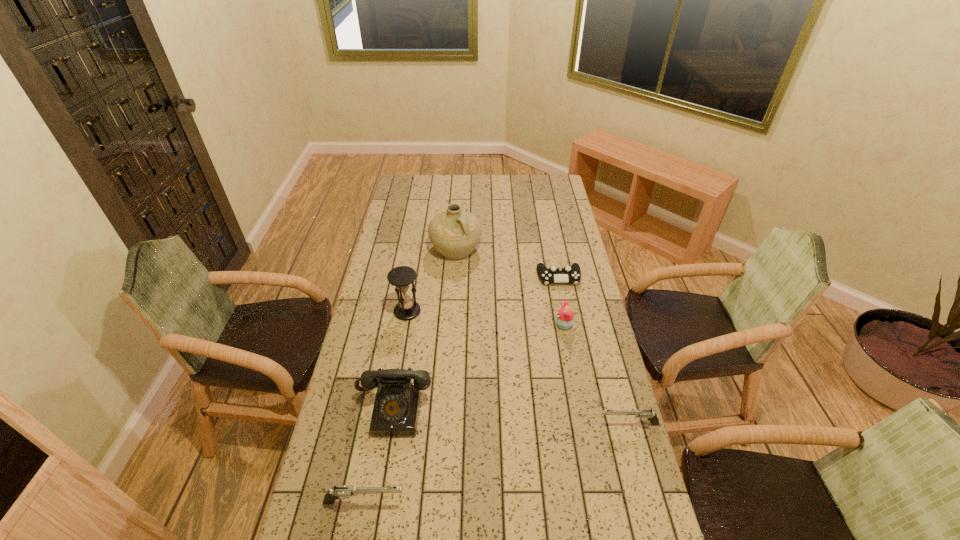
You are a GUI agent. You are given a task and a screenshot of the screen. Output one action in this format:
    pyautogui.click(x=<x>, y=<y>)
    Task: Click on the vacant space that's between the cupcake and the control
    
    Given the screenshot: What is the action you would take?
    pyautogui.click(x=562, y=301)

I want to click on free point between the cupcake and the left pistol, so click(x=464, y=414).

Locate an element on the screen. The width and height of the screenshot is (960, 540). the second closest object to the farther pistol is located at coordinates (396, 408).

The width and height of the screenshot is (960, 540). Find the location of `the second closest object relative to the sixth nearest object`. the second closest object relative to the sixth nearest object is located at coordinates (455, 233).

At what (x,y) coordinates should I click in order to perform the action: click on free space that satisfies the following two spatial constraints: 1. on the surface of the second farthest object; 2. on the face of the cupcake. Please return your answer as a coordinate pair (x, y). This screenshot has height=540, width=960. Looking at the image, I should click on (568, 325).

Locate an element on the screen. The height and width of the screenshot is (540, 960). free location that satisfies the following two spatial constraints: 1. on the surface of the second farthest object; 2. on the face of the cupcake is located at coordinates (568, 325).

The image size is (960, 540). Find the location of `blank space that satisfies the following two spatial constraints: 1. on the surface of the control; 2. on the front-facing side of the left pistol`. blank space that satisfies the following two spatial constraints: 1. on the surface of the control; 2. on the front-facing side of the left pistol is located at coordinates (603, 502).

Locate an element on the screen. free space that satisfies the following two spatial constraints: 1. on the dial of the third tallest object; 2. on the front-facing side of the nearest object is located at coordinates (x=378, y=502).

At what (x,y) coordinates should I click in order to perform the action: click on vacant position in the image that satisfies the following two spatial constraints: 1. on the surface of the control; 2. on the front-facing side of the nearest object. Please return your answer as a coordinate pair (x, y). The width and height of the screenshot is (960, 540). Looking at the image, I should click on (603, 502).